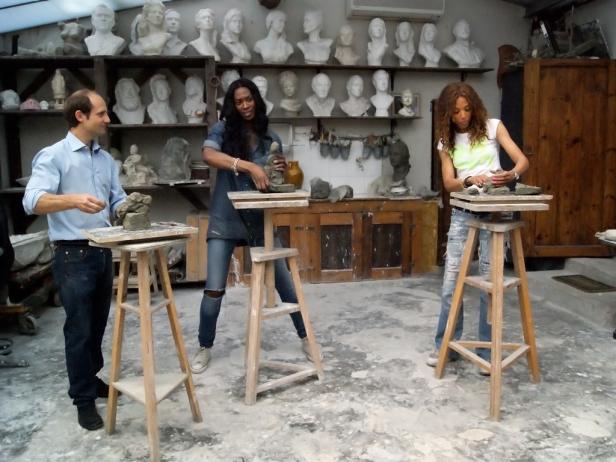
I want to click on floor mat, so click(x=588, y=287).